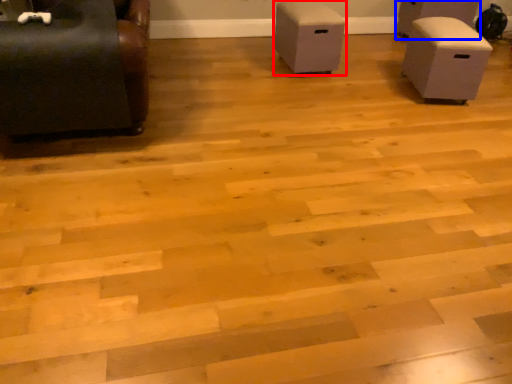
Question: Which of the following is the closest to the observer, furniture (highlighted by a red box) or furniture (highlighted by a blue box)?

Choices:
 (A) furniture
 (B) furniture

Answer: (A)